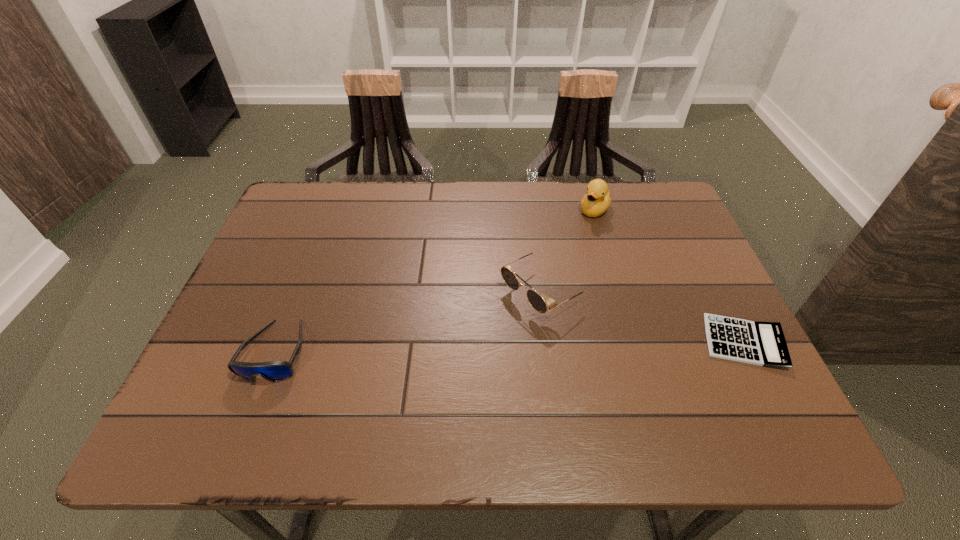
Select which object is the closest to the shorter sunglasses. Please provide its 2D coordinates. Your answer should be formatted as a tuple, i.e. [(x, y)], where the tuple contains the x and y coordinates of a point satisfying the conditions above.

[(536, 301)]

You are a GUI agent. You are given a task and a screenshot of the screen. Output one action in this format:
    pyautogui.click(x=<x>, y=<y>)
    Task: Click on the closest object relative to the shorter sunglasses
    The image size is (960, 540).
    Given the screenshot: What is the action you would take?
    pyautogui.click(x=536, y=301)

This screenshot has width=960, height=540. What are the coordinates of `free space that satisfies the following two spatial constraints: 1. on the front side of the duckling; 2. on the left side of the rightmost object` in the screenshot? It's located at (634, 342).